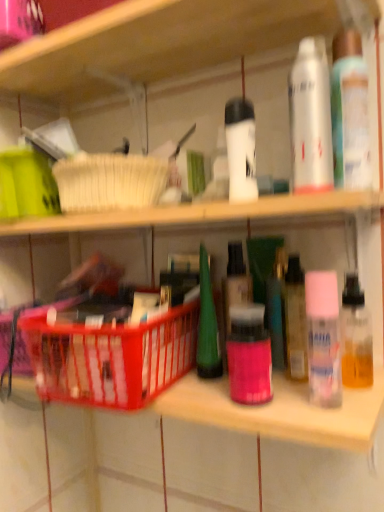
Question: Looking at the image, does white matte spray can at upper right seem bigger or smaller compared to white matte spray can at upper center, which appears as the second toiletry when viewed from the top?

Choices:
 (A) big
 (B) small

Answer: (A)

Question: Choose the correct answer: Is white matte spray can at upper right inside white matte spray can at upper center, which appears as the second toiletry when viewed from the top, or outside it?

Choices:
 (A) outside
 (B) inside

Answer: (A)

Question: Considering the real-world distances, which object is farthest from the translucent plastic basket at center?

Choices:
 (A) pink matte bottle at center, positioned as the 4th toiletry in top-to-bottom order
 (B) translucent plastic spray can at upper right, which is the fourth toiletry in bottom-to-top order
 (C) white matte spray can at upper right
 (D) pink matte spray can at right, acting as the 2th toiletry starting from the bottom
 (E) white matte spray can at upper center, which appears as the second toiletry when viewed from the top

Answer: (B)

Question: Which object is the closest to the translucent plastic basket at center?

Choices:
 (A) pink matte bottle at center, arranged as the 1th toiletry when ordered from the bottom
 (B) pink matte spray can at right, acting as the 3th toiletry starting from the top
 (C) white matte spray can at upper center, which appears as the second toiletry when viewed from the top
 (D) translucent plastic spray can at upper right, placed as the 1th toiletry when sorted from top to bottom
 (E) white matte spray can at upper right

Answer: (A)